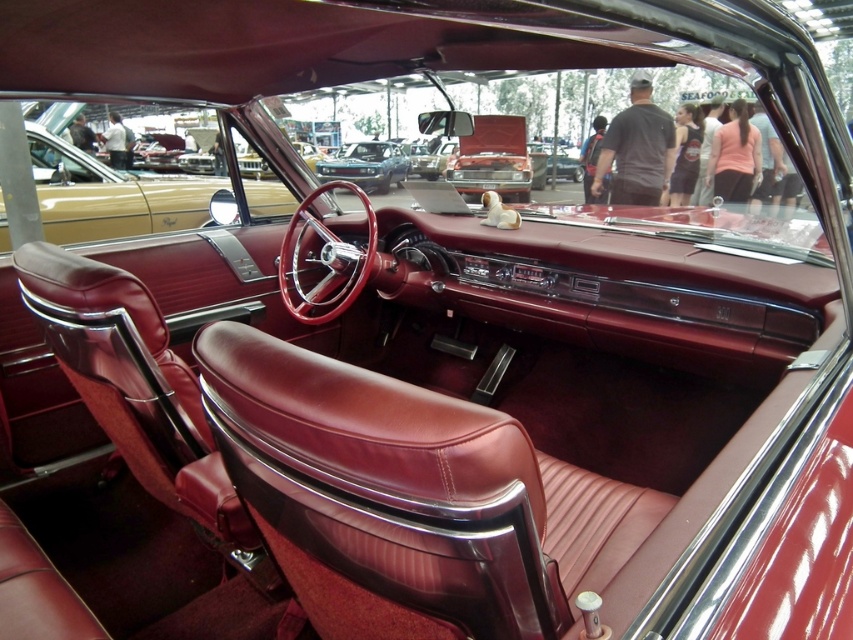
The width and height of the screenshot is (853, 640). Describe the element at coordinates (109, 195) in the screenshot. I see `maroon leather steering wheel at center` at that location.

Can you confirm if maroon leather steering wheel at center is bigger than metallic blue car at center?

No, maroon leather steering wheel at center is not bigger than metallic blue car at center.

Identify the location of maroon leather steering wheel at center. The width and height of the screenshot is (853, 640). (109, 195).